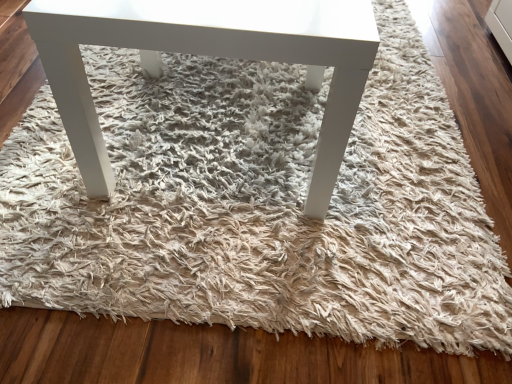
The image size is (512, 384). Identify the location of vacant area that is in front of white matte table at center. (212, 271).